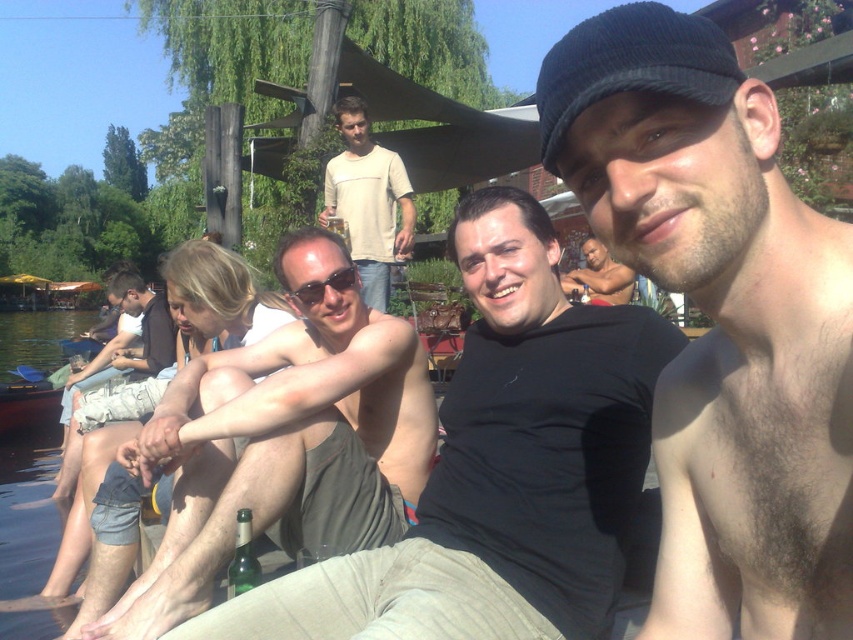
Question: Does shiny black skin at center lie behind light beige cotton shirt at center?

Choices:
 (A) no
 (B) yes

Answer: (A)

Question: Does light beige cotton shirt at center appear under matte black sunglasses at center?

Choices:
 (A) yes
 (B) no

Answer: (B)

Question: Is shiny skin at center thinner than tan skin shirtless man at center?

Choices:
 (A) no
 (B) yes

Answer: (A)

Question: Which point is farther to the camera?

Choices:
 (A) shiny black skin at center
 (B) matte black sunglasses at center

Answer: (B)

Question: Which of the following is the closest to the observer?

Choices:
 (A) (349, 192)
 (B) (776, 353)
 (C) (364, 540)

Answer: (B)

Question: Considering the real-world distances, which object is closest to the smooth skin torso at center?

Choices:
 (A) matte black sunglasses at center
 (B) shiny skin at center
 (C) tan skin shirtless man at center

Answer: (C)